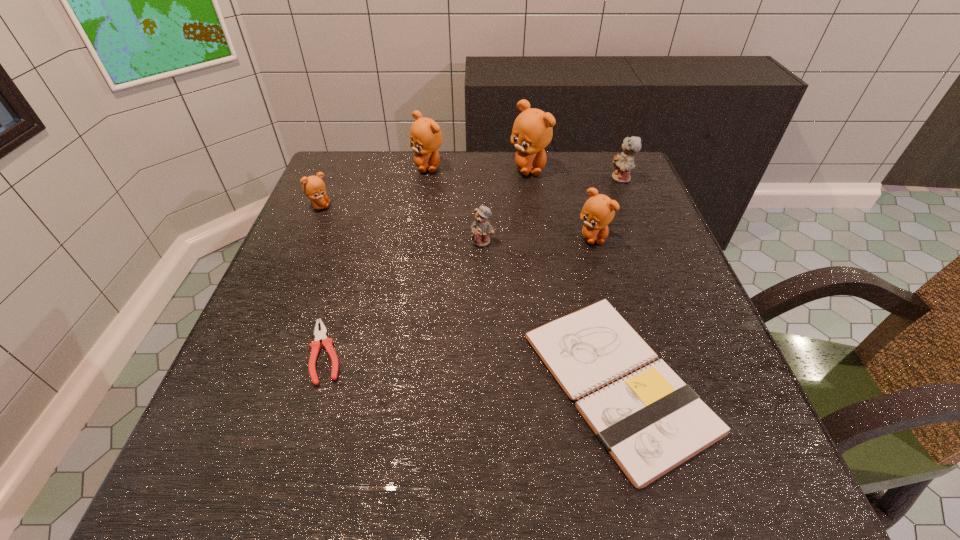
Where is `unoccupied position between the notepad and the biggest brown teddy bear`? This screenshot has width=960, height=540. unoccupied position between the notepad and the biggest brown teddy bear is located at coordinates (573, 275).

Where is `free space that is in between the rightmost brown teddy bear and the smaller blue teddy bear`? The height and width of the screenshot is (540, 960). free space that is in between the rightmost brown teddy bear and the smaller blue teddy bear is located at coordinates (538, 239).

This screenshot has width=960, height=540. I want to click on vacant region between the shortest object and the tallest object, so click(x=427, y=260).

Locate an element on the screen. The width and height of the screenshot is (960, 540). free area in between the shortest object and the fifth object from right to left is located at coordinates (404, 297).

Image resolution: width=960 pixels, height=540 pixels. Identify the location of free space between the seventh tallest object and the third brown teddy bear from right to left. (523, 274).

Where is `vacant area between the second object from left to right and the tallest object`? The height and width of the screenshot is (540, 960). vacant area between the second object from left to right and the tallest object is located at coordinates (427, 260).

Where is `free space between the seventh tallest object and the leftmost object`? Image resolution: width=960 pixels, height=540 pixels. free space between the seventh tallest object and the leftmost object is located at coordinates (468, 294).

Locate an element on the screen. unoccupied area between the pliers and the second tallest object is located at coordinates (377, 259).

Identify which object is the fourth closest to the left blue teddy bear. Please provide its 2D coordinates. Your answer should be formatted as a tuple, i.e. [(x, y)], where the tuple contains the x and y coordinates of a point satisfying the conditions above.

[(425, 135)]

I want to click on object that can be found as the third closest to the bigger blue teddy bear, so [x=481, y=229].